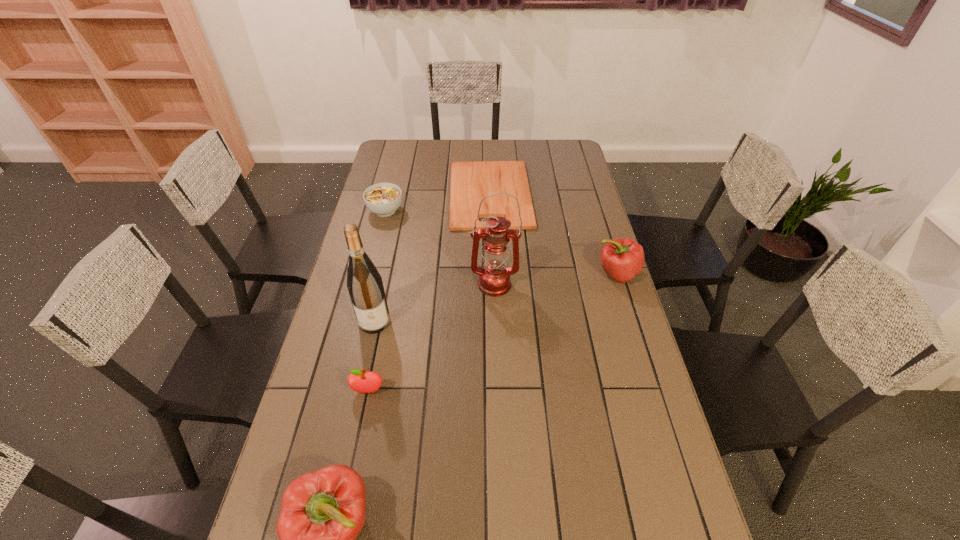
Find the location of `vacant space situated 0.280m on the back of the soup bowl`. vacant space situated 0.280m on the back of the soup bowl is located at coordinates (397, 164).

Image resolution: width=960 pixels, height=540 pixels. I want to click on vacant area situated on the front of the wine bottle, so click(x=356, y=404).

The width and height of the screenshot is (960, 540). In order to click on free space located on the back of the oil lamp in this screenshot , I will do `click(492, 206)`.

You are a GUI agent. You are given a task and a screenshot of the screen. Output one action in this format:
    pyautogui.click(x=<x>, y=<y>)
    Task: Click on the blank area located on the back of the apple
    The width and height of the screenshot is (960, 540).
    Given the screenshot: What is the action you would take?
    pyautogui.click(x=382, y=324)

Where is `object present at the far edge`? object present at the far edge is located at coordinates (470, 181).

I want to click on soup bowl situated at the left edge, so click(x=383, y=199).

In order to click on wine bottle that is at the left edge in this screenshot , I will do `click(364, 283)`.

Where is `apple that is at the left edge`? The width and height of the screenshot is (960, 540). apple that is at the left edge is located at coordinates (360, 381).

At what (x,y) coordinates should I click in order to perform the action: click on object that is at the right edge. Please return your answer as a coordinate pair (x, y). This screenshot has height=540, width=960. Looking at the image, I should click on (623, 258).

In the image, there is a desktop. Where is `vacant space at the far edge`? vacant space at the far edge is located at coordinates (420, 149).